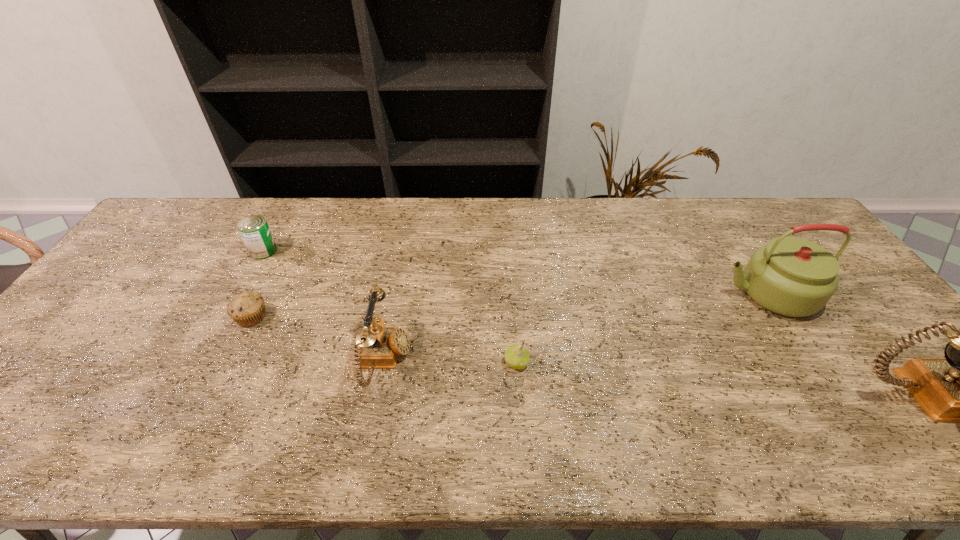
I want to click on empty space between the shortest object and the kettle, so click(x=510, y=305).

What are the coordinates of `vacant space that's between the shorter telephone and the kettle` in the screenshot? It's located at (576, 327).

This screenshot has height=540, width=960. What are the coordinates of `blank region between the kettle and the muffin` in the screenshot? It's located at (510, 305).

Choose which object is the second nearest neighbor to the kettle. Please provide its 2D coordinates. Your answer should be formatted as a tuple, i.e. [(x, y)], where the tuple contains the x and y coordinates of a point satisfying the conditions above.

[(516, 356)]

Identify the location of object that stands as the second closest to the shorter telephone. The width and height of the screenshot is (960, 540). click(247, 309).

Find the location of a particular element. free region that satisfies the following two spatial constraints: 1. on the dial number of the shorter telephone; 2. on the right side of the third object from right to left is located at coordinates (384, 363).